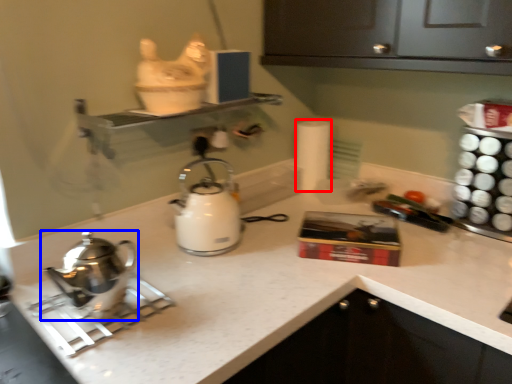
Question: Which object appears farthest to the camera in this image, toilet paper (highlighted by a red box) or kettle (highlighted by a blue box)?

Choices:
 (A) toilet paper
 (B) kettle

Answer: (A)